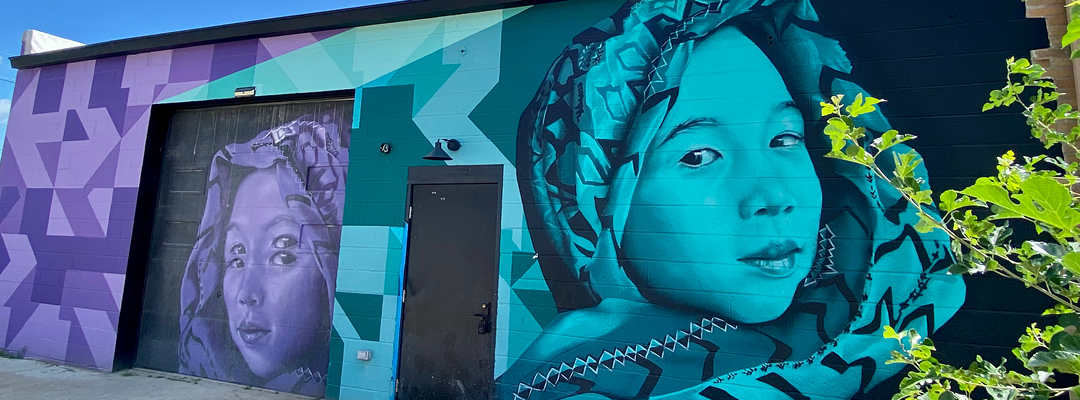
This screenshot has height=400, width=1080. Find the location of `door`. door is located at coordinates (459, 280).